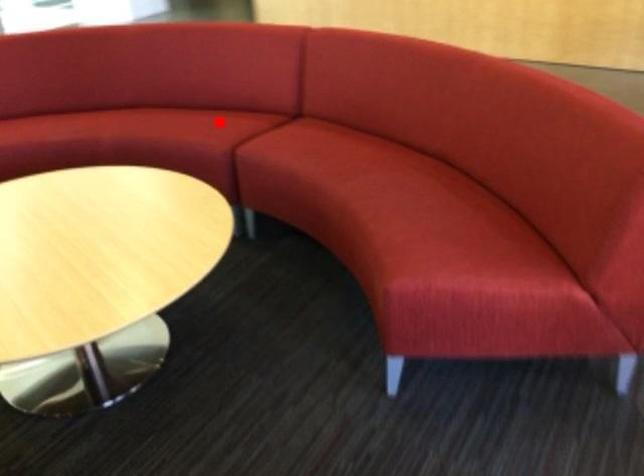
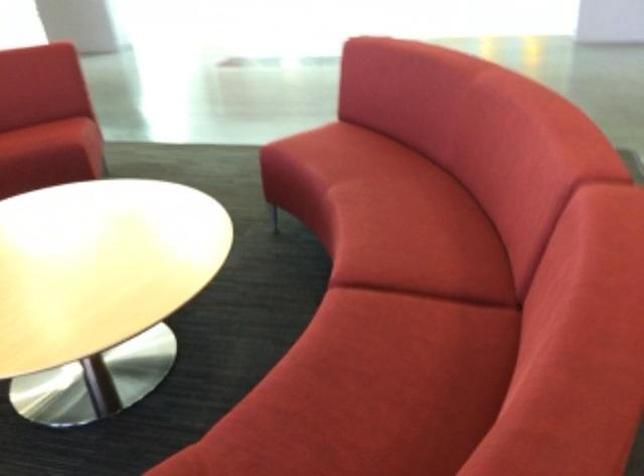
Question: I am providing you with two images of the same scene from different viewpoints. In image1, a red point is highlighted. Considering the same 3D point in image2, which of the following is correct?

Choices:
 (A) It is closer
 (B) It is farther

Answer: (A)